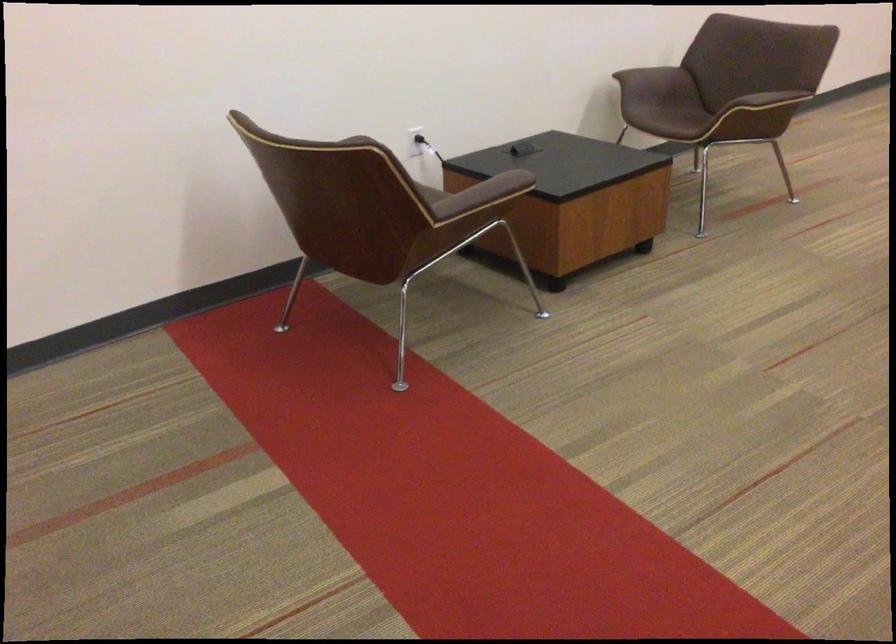
This screenshot has height=644, width=896. What are the coordinates of `brown chair armrest` in the screenshot? It's located at (779, 98).